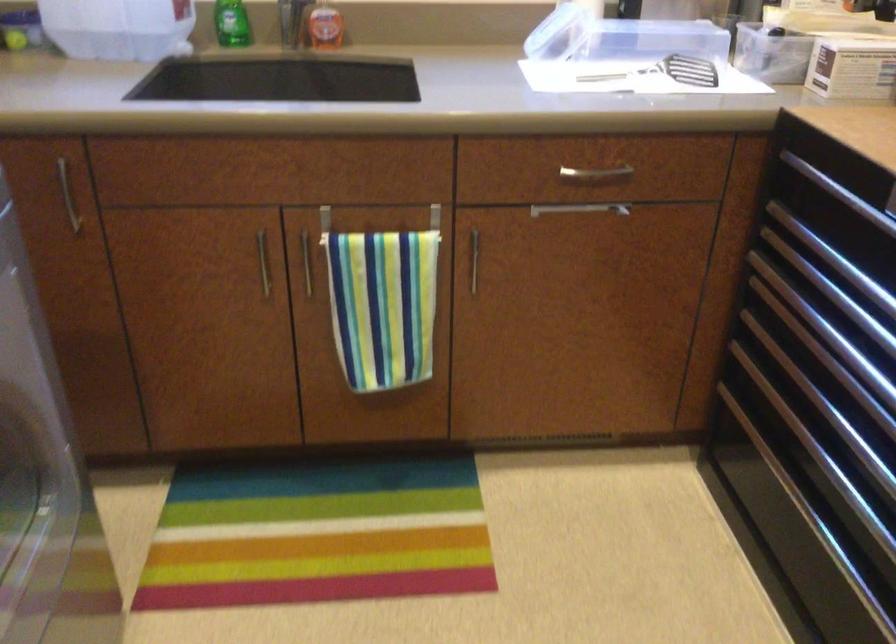
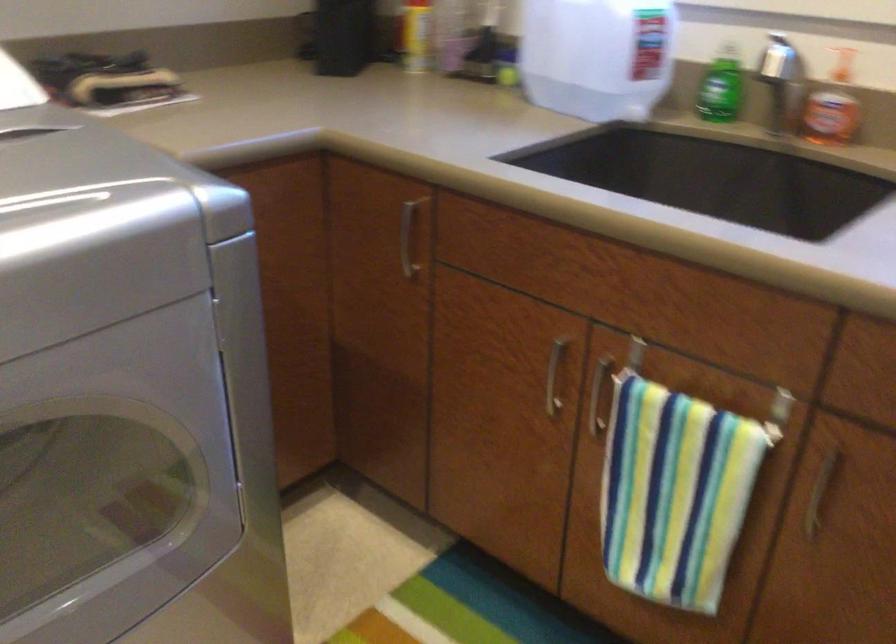
Locate, in the second image, the point that corresponds to point (393, 222) in the first image.

(727, 393)